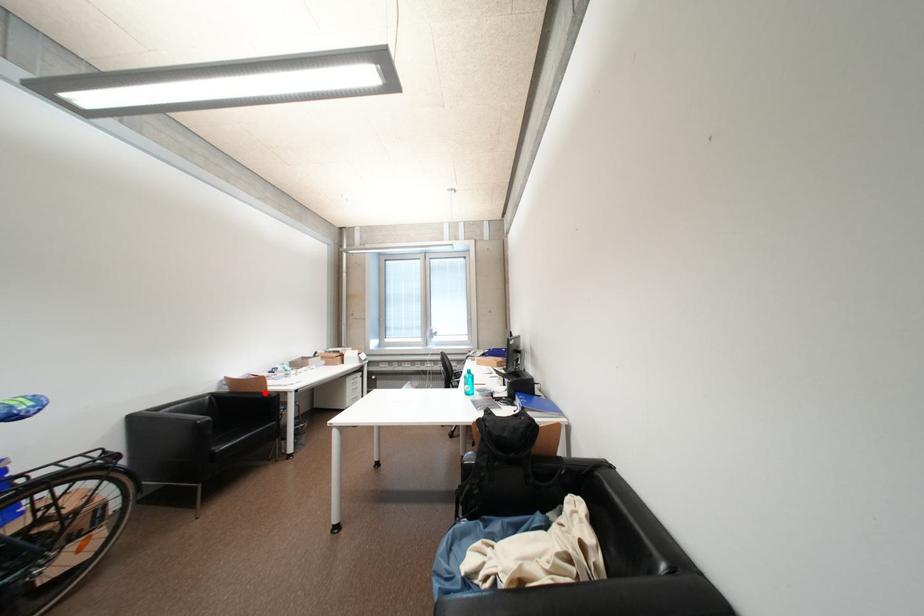
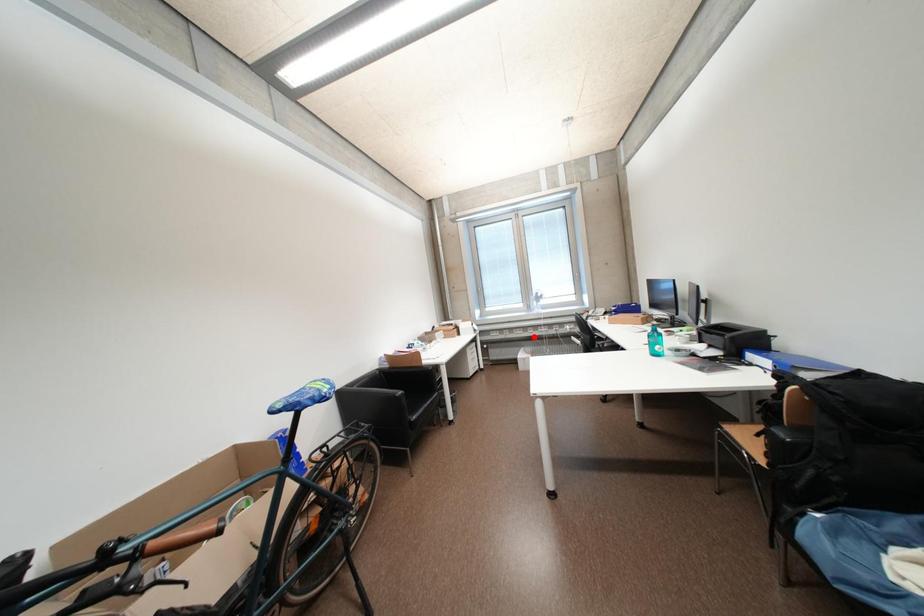
I am providing you with two images of the same scene from different viewpoints. A red point is marked on the first image and another point is marked on the second image. Do the highlighted points in image1 and image2 indicate the same real-world spot?

No